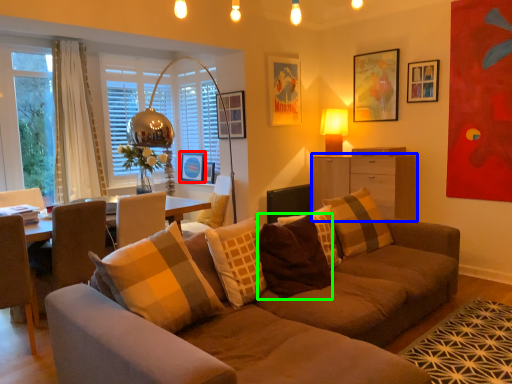
Question: Which object is the farthest from picture frame (highlighted by a red box)? Choose among these: cabinetry (highlighted by a blue box) or pillow (highlighted by a green box).

Choices:
 (A) cabinetry
 (B) pillow

Answer: (B)